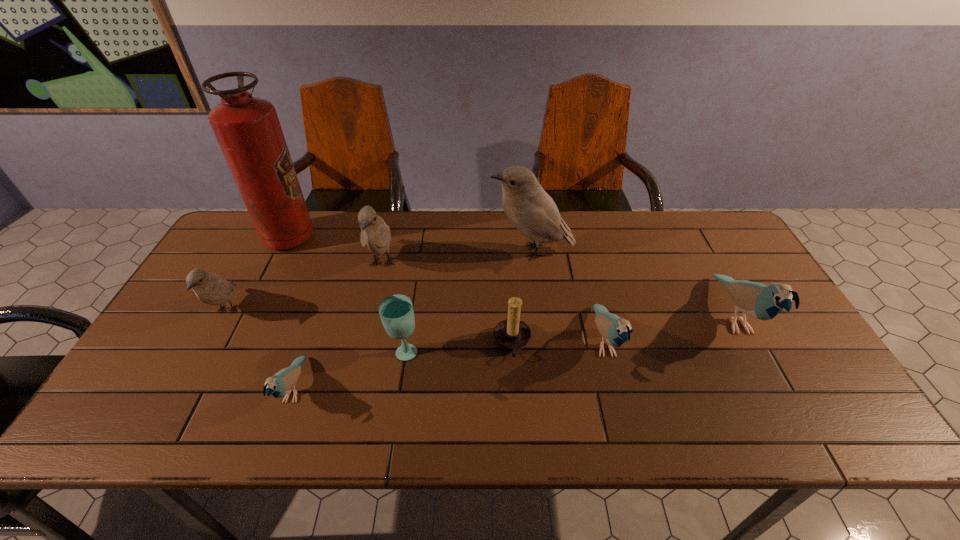
Image resolution: width=960 pixels, height=540 pixels. I want to click on red fire extinguisher, so click(x=248, y=131).

Find the location of `the tallest object`. the tallest object is located at coordinates (x=248, y=131).

Find the location of a particular element. the eighth shortest object is located at coordinates (532, 211).

Where is `the rightmost white bird`? The width and height of the screenshot is (960, 540). the rightmost white bird is located at coordinates (532, 211).

This screenshot has width=960, height=540. I want to click on the fourth object from left to right, so click(375, 234).

Where is `the third bird from left to right`? The height and width of the screenshot is (540, 960). the third bird from left to right is located at coordinates (375, 234).

Image resolution: width=960 pixels, height=540 pixels. I want to click on the rightmost blue bird, so click(756, 300).

Where is `the biggest blue bird`? The width and height of the screenshot is (960, 540). the biggest blue bird is located at coordinates (756, 300).

At what (x,y) coordinates should I click in order to perform the action: click on the nearest white bird. Please return your answer as a coordinate pair (x, y). Image resolution: width=960 pixels, height=540 pixels. Looking at the image, I should click on (210, 288).

Where is `the leftmost white bird`? This screenshot has height=540, width=960. the leftmost white bird is located at coordinates (210, 288).